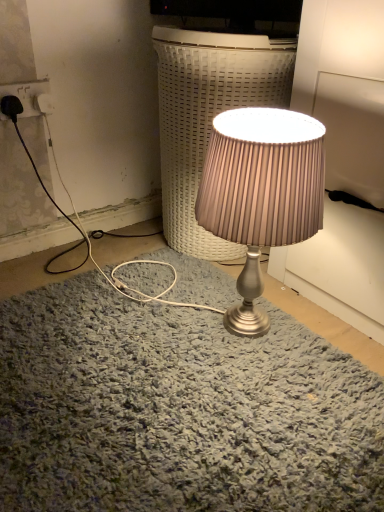
Question: In the image, is satin silver lamp at center on the left side or the right side of white plastic socket at upper left?

Choices:
 (A) left
 (B) right

Answer: (B)

Question: Considering the positions of satin silver lamp at center and white plastic socket at upper left in the image, is satin silver lamp at center taller or shorter than white plastic socket at upper left?

Choices:
 (A) tall
 (B) short

Answer: (A)

Question: Which object is positioned farthest from the satin silver lamp at center?

Choices:
 (A) white plastic socket at upper left
 (B) satin silver lamp at center

Answer: (A)

Question: Estimate the real-world distances between objects in this image. Which object is closer to the satin silver lamp at center?

Choices:
 (A) white plastic socket at upper left
 (B) satin silver lamp at center

Answer: (B)